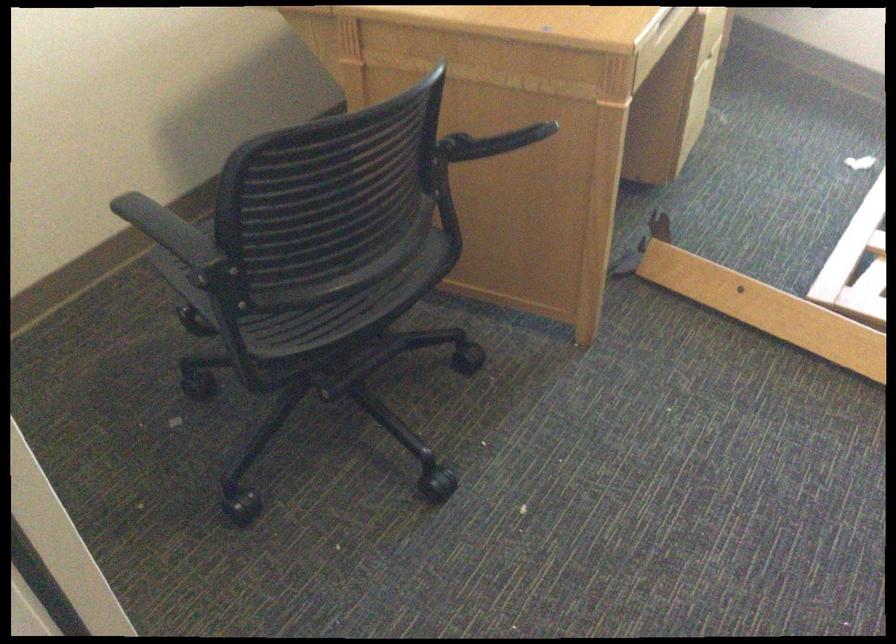
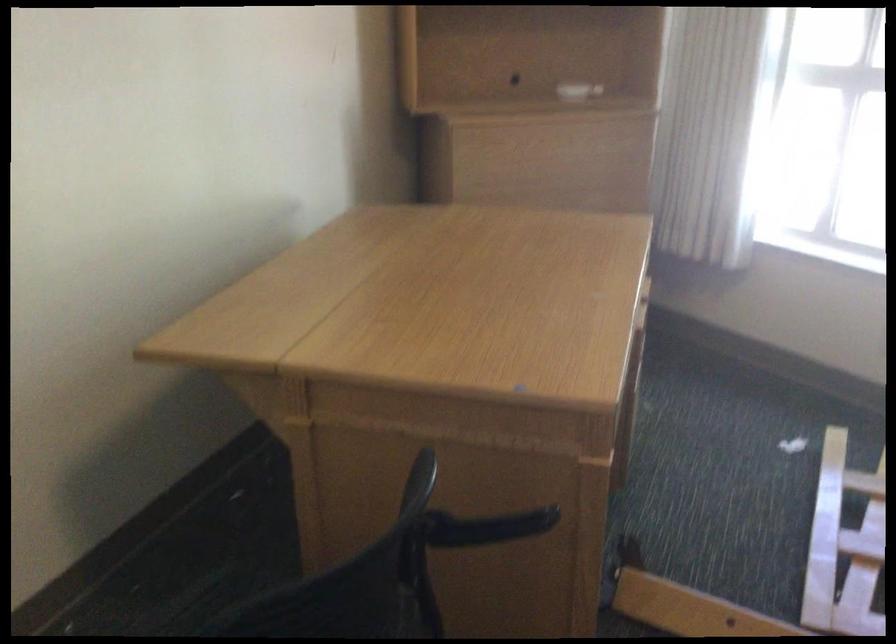
Which direction would the cameraman need to move to produce the second image?

The cameraman moved toward left, forward.